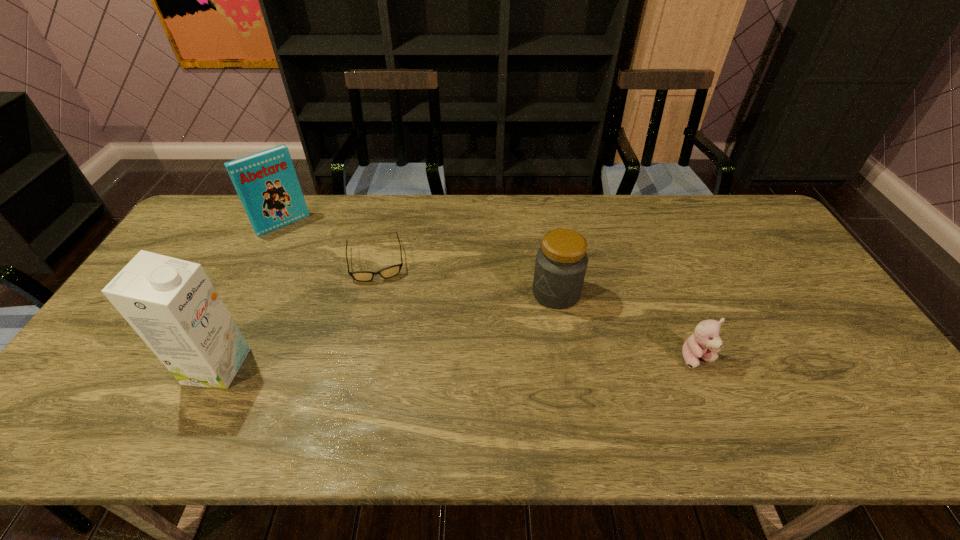
At what (x,y) coordinates should I click in order to perform the action: click on the tallest object. Please return your answer as a coordinate pair (x, y). This screenshot has width=960, height=540. Looking at the image, I should click on (172, 305).

At what (x,y) coordinates should I click in order to perform the action: click on teddy bear. Please return your answer as a coordinate pair (x, y). Looking at the image, I should click on (705, 342).

At what (x,y) coordinates should I click in order to perform the action: click on the rightmost object. Please return your answer as a coordinate pair (x, y). The width and height of the screenshot is (960, 540). Looking at the image, I should click on (705, 342).

Where is `jar`? The height and width of the screenshot is (540, 960). jar is located at coordinates (561, 262).

At what (x,y) coordinates should I click in order to perform the action: click on the fourth object from left to right. Please return your answer as a coordinate pair (x, y). Image resolution: width=960 pixels, height=540 pixels. Looking at the image, I should click on (561, 262).

Identify the location of sunglasses. The height and width of the screenshot is (540, 960). (363, 276).

Identify the location of the shortest object. The image size is (960, 540). (363, 276).

You are a GUI agent. You are given a task and a screenshot of the screen. Output one action in this format:
    pyautogui.click(x=<x>, y=<y>)
    Task: Click on the book
    The height and width of the screenshot is (540, 960).
    Given the screenshot: What is the action you would take?
    pyautogui.click(x=266, y=182)

Where is `the farthest object`? the farthest object is located at coordinates (266, 182).

What are the coordinates of `free space located on the left of the carton` in the screenshot? It's located at (94, 366).